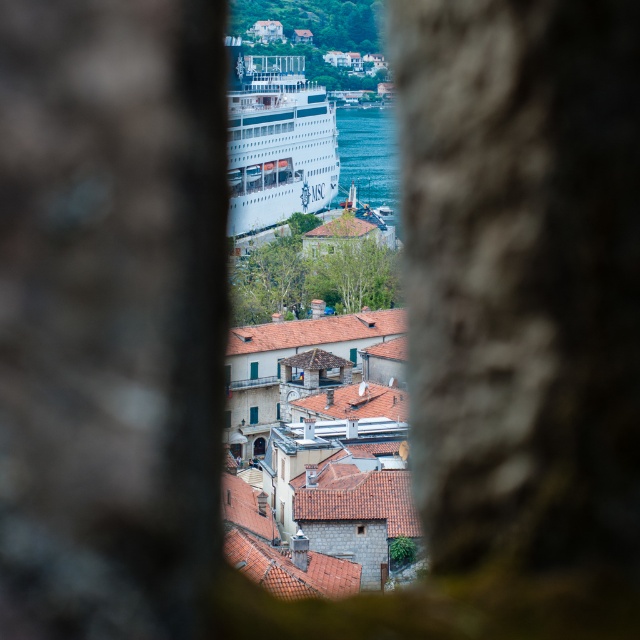
Which of these two, white glossy cruise ship at center or blue water at center, stands taller?

Standing taller between the two is white glossy cruise ship at center.

Which is below, white glossy cruise ship at center or blue water at center?

white glossy cruise ship at center is lower down.

Does point (243, 180) lie in front of point (346, 154)?

That is True.

You are a GUI agent. You are given a task and a screenshot of the screen. Output one action in this format:
    pyautogui.click(x=<x>, y=<y>)
    Task: Click on the white glossy cruise ship at center
    The image size is (640, 640).
    Given the screenshot: What is the action you would take?
    pyautogui.click(x=276, y=140)

Can you confirm if blue water at center is taller than green glass window at center?

Yes, blue water at center is taller than green glass window at center.

Does blue water at center have a lesser width compared to green glass window at center?

No, blue water at center is not thinner than green glass window at center.

Does point (342, 180) lie in front of point (253, 368)?

No, (342, 180) is behind (253, 368).

The width and height of the screenshot is (640, 640). In order to click on blue water at center in this screenshot , I will do `click(368, 154)`.

Measure the distance between blue water at center and camera.

They are 355.15 meters apart.

Measure the distance between blue water at center and blue glass window at center.

349.14 meters

Is point (356, 125) more distant than point (252, 406)?

Yes, it is.

This screenshot has width=640, height=640. Identify the location of blue water at center. (368, 154).